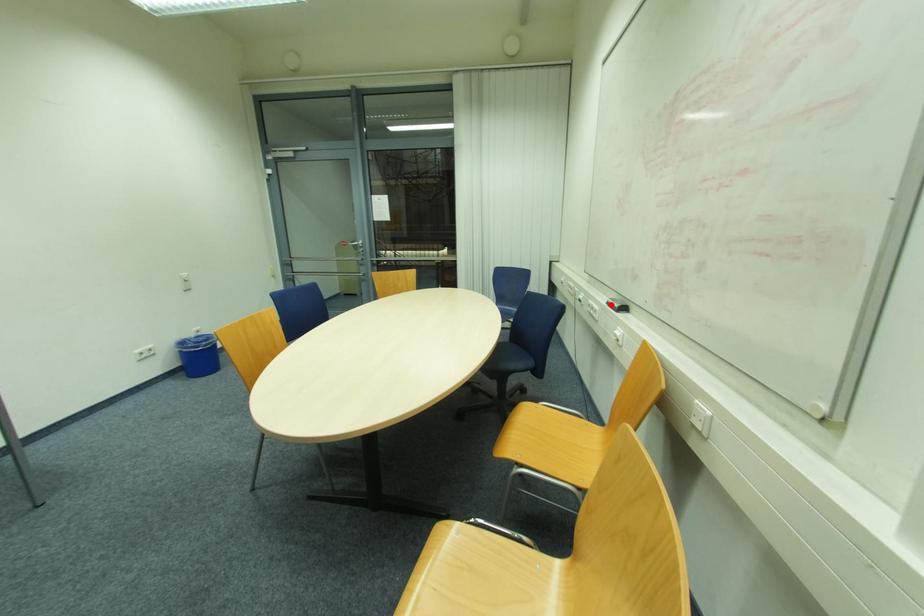
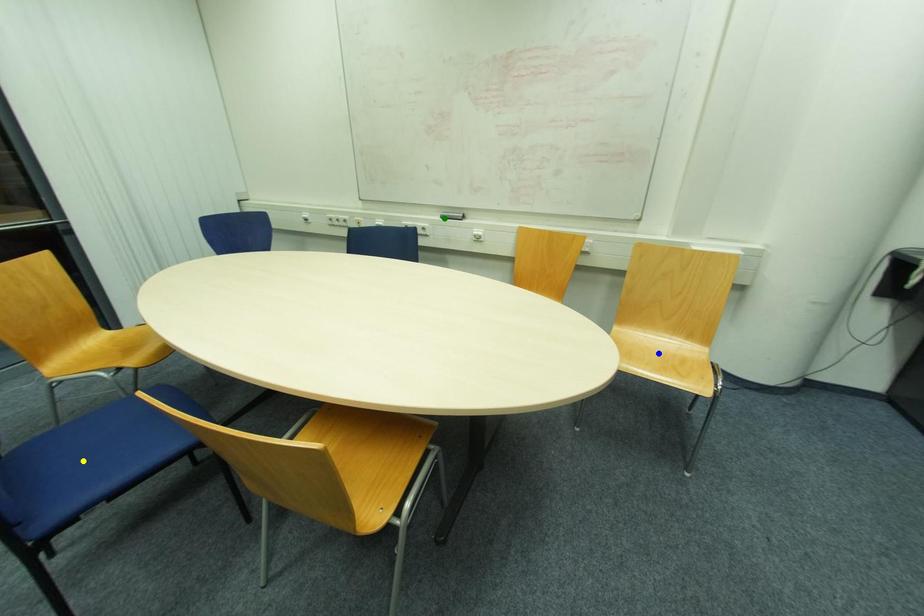
Question: I am providing you with two images of the same scene from different viewpoints. A red point is marked on the first image. You are given multiple points on the second image. Which point in image 2 is actually the same real-world point as the red point in image 1?

Choices:
 (A) yellow point
 (B) blue point
 (C) green point

Answer: (C)